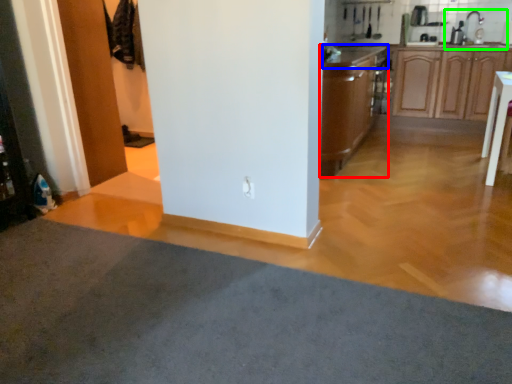
Question: Estimate the real-world distances between objects in this image. Which object is closer to cabinetry (highlighted by a red box), countertop (highlighted by a blue box) or sink (highlighted by a green box)?

Choices:
 (A) countertop
 (B) sink

Answer: (A)